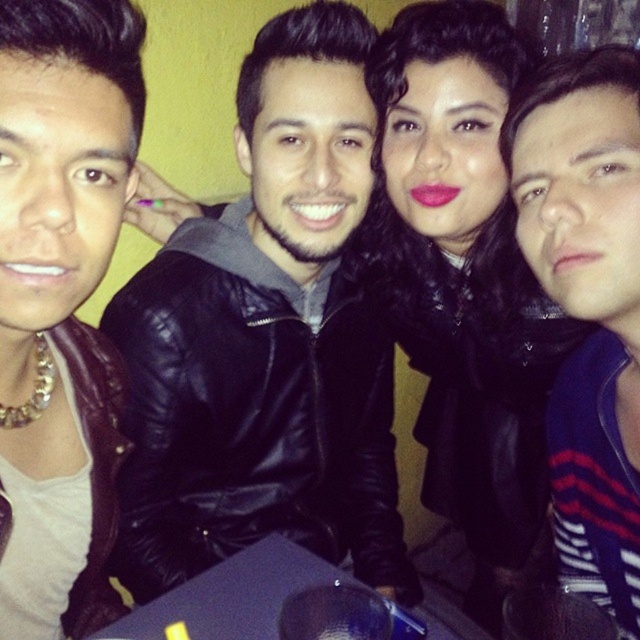
Question: Can you confirm if black leather jacket at center is wider than black leather jacket at upper center?

Choices:
 (A) yes
 (B) no

Answer: (A)

Question: Which object appears farthest from the camera in this image?

Choices:
 (A) dark blue sweater at right
 (B) black leather jacket at center
 (C) black leather jacket at upper center

Answer: (C)

Question: Which object is the farthest from the black leather jacket at center?

Choices:
 (A) dark blue sweater at right
 (B) black leather jacket at upper center

Answer: (A)

Question: Which point is farther to the camera?

Choices:
 (A) black leather jacket at center
 (B) dark blue sweater at right

Answer: (A)

Question: Does black leather jacket at upper center appear under dark blue sweater at right?

Choices:
 (A) yes
 (B) no

Answer: (A)

Question: Is black leather jacket at center to the right of black leather jacket at upper center from the viewer's perspective?

Choices:
 (A) yes
 (B) no

Answer: (B)